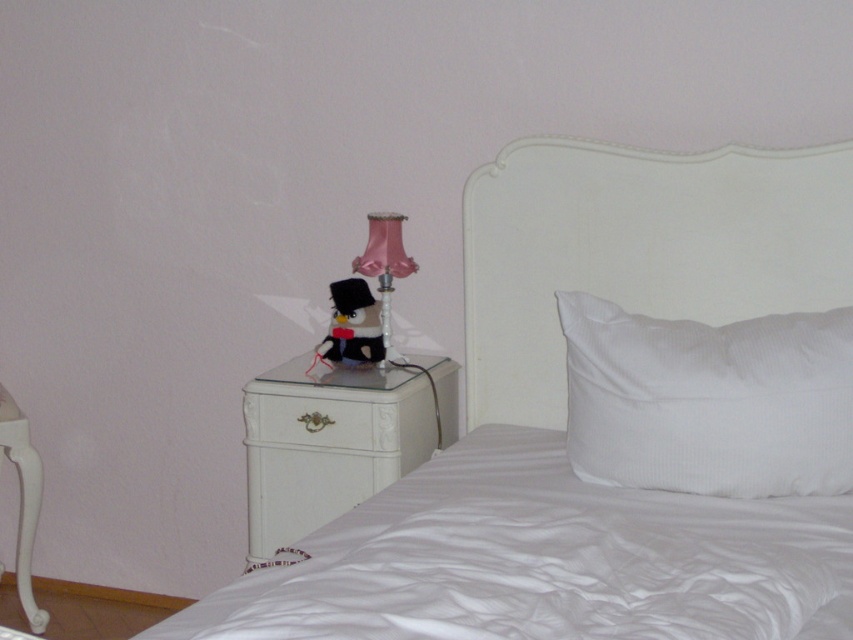
How distant is white glossy drawer at lower left from pink satin lamp at upper right?

The distance of white glossy drawer at lower left from pink satin lamp at upper right is 12.67 inches.

Which is in front, point (294, 424) or point (390, 305)?

Point (294, 424)

Between point (343, 417) and point (352, 262), which one is positioned behind?

The point (352, 262) is behind.

You are a GUI agent. You are given a task and a screenshot of the screen. Output one action in this format:
    pyautogui.click(x=<x>, y=<y>)
    Task: Click on the white glossy drawer at lower left
    The image size is (853, 640).
    Given the screenshot: What is the action you would take?
    pyautogui.click(x=309, y=420)

Who is more forward, (x=500, y=220) or (x=332, y=316)?

Point (x=500, y=220)

Measure the distance between point (537, 221) and camera.

8.78 feet

Find the location of a particular element. This screenshot has height=640, width=853. white matte headboard at upper right is located at coordinates (637, 250).

Can you confirm if white glossy dresser at lower left is positioned to the left of velvet black plush at upper center?

Yes, white glossy dresser at lower left is to the left of velvet black plush at upper center.

Is white glossy dresser at lower left to the right of velvet black plush at upper center from the viewer's perspective?

No, white glossy dresser at lower left is not to the right of velvet black plush at upper center.

Describe the element at coordinates (335, 440) in the screenshot. This screenshot has height=640, width=853. I see `white glossy dresser at lower left` at that location.

Locate an element on the screen. This screenshot has width=853, height=640. white glossy dresser at lower left is located at coordinates (335, 440).